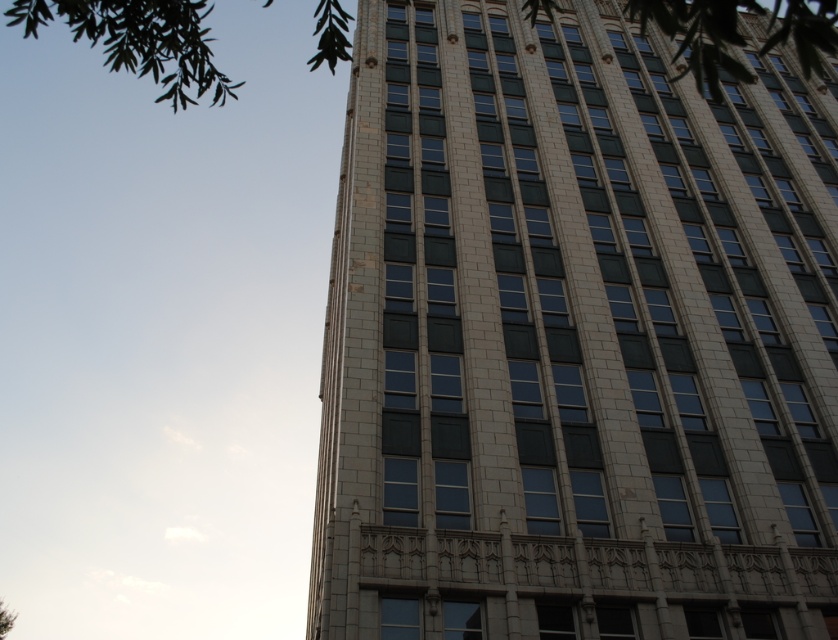
Can you confirm if white stone building at center is positioned to the left of green leafy tree at upper left?

Incorrect, white stone building at center is not on the left side of green leafy tree at upper left.

Does white stone building at center come in front of green leafy tree at upper left?

No, white stone building at center is behind green leafy tree at upper left.

Is point (449, 419) behind point (741, 81)?

Yes, point (449, 419) is farther from viewer.

Locate an element on the screen. The image size is (838, 640). white stone building at center is located at coordinates (573, 340).

From the picture: Can you confirm if white stone building at center is shorter than green leafy tree at lower left?

Yes.

Is point (568, 481) closer to camera compared to point (8, 616)?

Yes.

You are a GUI agent. You are given a task and a screenshot of the screen. Output one action in this format:
    pyautogui.click(x=<x>, y=<y>)
    Task: Click on the white stone building at center
    
    Given the screenshot: What is the action you would take?
    pyautogui.click(x=573, y=340)

Between green leafy tree at upper left and green leafy tree at lower left, which one has more height?

With more height is green leafy tree at upper left.

Find the location of a particular element. green leafy tree at upper left is located at coordinates (140, 40).